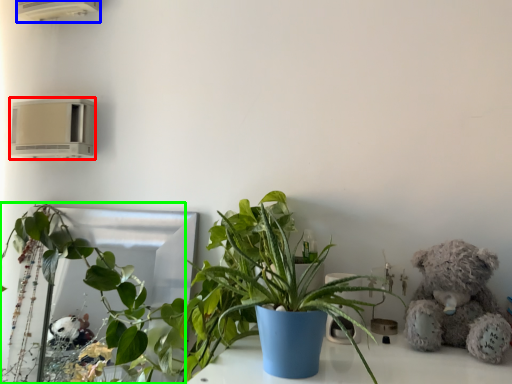
Question: Which object is the closest to the air conditioning (highlighted by a red box)? Choose among these: air conditioning (highlighted by a blue box) or houseplant (highlighted by a green box).

Choices:
 (A) air conditioning
 (B) houseplant

Answer: (B)